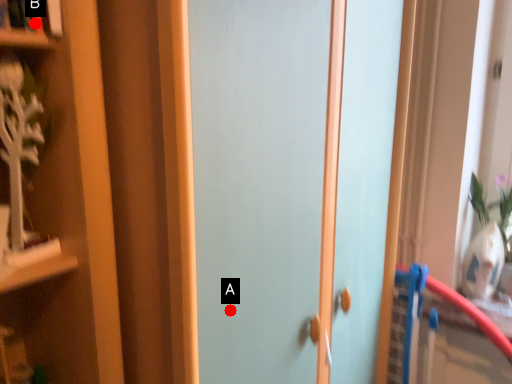
Question: Two points are circled on the image, labeled by A and B beside each circle. Which point is closer to the camera taking this photo?

Choices:
 (A) A is closer
 (B) B is closer

Answer: (B)